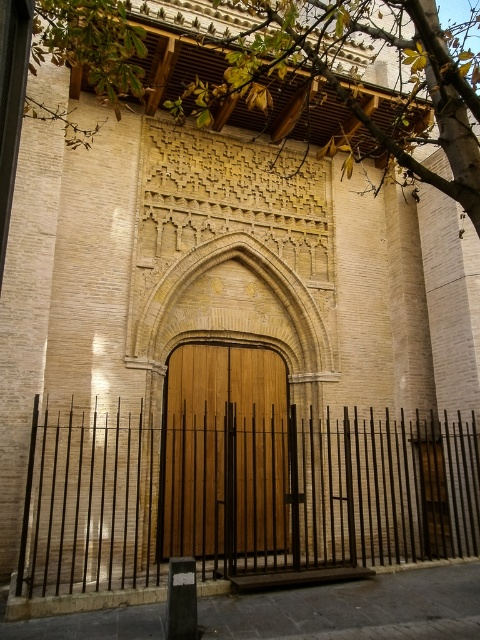
Question: Which object is the closest to the black metal fence at center?

Choices:
 (A) green leafy tree at upper center
 (B) wooden door at center

Answer: (B)

Question: Is black metal fence at center to the left of wooden door at center from the viewer's perspective?

Choices:
 (A) yes
 (B) no

Answer: (B)

Question: Which object is positioned farthest from the black metal fence at center?

Choices:
 (A) green leafy tree at upper center
 (B) wooden door at center

Answer: (A)

Question: Where is black metal fence at center located in relation to green leafy tree at upper center in the image?

Choices:
 (A) right
 (B) left

Answer: (B)

Question: Is black metal fence at center above wooden door at center?

Choices:
 (A) yes
 (B) no

Answer: (B)

Question: Which point is closer to the camera?

Choices:
 (A) wooden door at center
 (B) green leafy tree at upper center
 (C) black metal fence at center

Answer: (B)